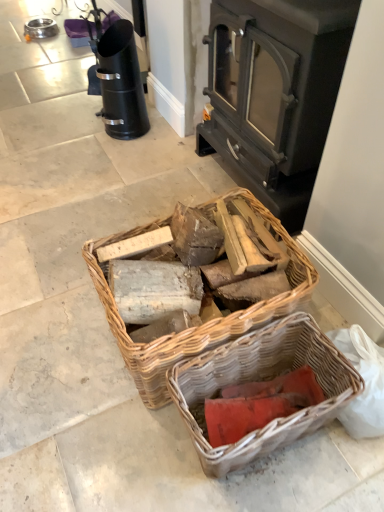
At what (x,y) coordinates should I click in order to perform the action: click on woven wood basket at center, the first picnic basket viewed from the top. Please return your answer as a coordinate pair (x, y). Image resolution: width=384 pixels, height=512 pixels. Looking at the image, I should click on (205, 324).

The image size is (384, 512). What do you see at coordinates (275, 93) in the screenshot? I see `dark gray metal wood burning stove at center` at bounding box center [275, 93].

In order to click on red cardboard at lower center in this screenshot , I will do `click(258, 404)`.

The height and width of the screenshot is (512, 384). In order to click on woven wood basket at center, the first picnic basket viewed from the top in this screenshot , I will do `click(205, 324)`.

From the image's perspective, between woven wood basket at center, which ranks as the 2th picnic basket in bottom-to-top order, and rustic wicker basket at lower center, which is the 1th picnic basket in bottom-to-top order, who is located below?

rustic wicker basket at lower center, which is the 1th picnic basket in bottom-to-top order.

Is woven wood basket at center, which ranks as the 2th picnic basket in bottom-to-top order, closer to camera compared to rustic wicker basket at lower center, which appears as the second picnic basket when viewed from the top?

That is False.

Is woven wood basket at center, the first picnic basket viewed from the top, to the left of rustic wicker basket at lower center, which appears as the second picnic basket when viewed from the top, from the viewer's perspective?

Yes, woven wood basket at center, the first picnic basket viewed from the top, is to the left of rustic wicker basket at lower center, which appears as the second picnic basket when viewed from the top.

Can you confirm if woven wood basket at center, the first picnic basket viewed from the top, is bigger than dark gray metal wood burning stove at center?

No, woven wood basket at center, the first picnic basket viewed from the top, is not bigger than dark gray metal wood burning stove at center.

From a real-world perspective, does woven wood basket at center, the first picnic basket viewed from the top, stand above dark gray metal wood burning stove at center?

Incorrect, from a real-world perspective, woven wood basket at center, the first picnic basket viewed from the top, is lower than dark gray metal wood burning stove at center.

Can dark gray metal wood burning stove at center be found inside woven wood basket at center, which ranks as the 2th picnic basket in bottom-to-top order?

No, dark gray metal wood burning stove at center is not surrounded by woven wood basket at center, which ranks as the 2th picnic basket in bottom-to-top order.

From the image's perspective, is woven wood basket at center, the first picnic basket viewed from the top, located above or below dark gray metal wood burning stove at center?

Clearly, from the image's perspective, woven wood basket at center, the first picnic basket viewed from the top, is below dark gray metal wood burning stove at center.

From a real-world perspective, which picnic basket is the 2nd one underneath the dark gray metal wood burning stove at center? Please provide its 2D coordinates.

[(260, 380)]

Considering the relative positions of rustic wicker basket at lower center, which appears as the second picnic basket when viewed from the top, and dark gray metal wood burning stove at center in the image provided, is rustic wicker basket at lower center, which appears as the second picnic basket when viewed from the top, in front of dark gray metal wood burning stove at center?

That is True.

In the scene shown: Is rustic wicker basket at lower center, which appears as the second picnic basket when viewed from the top, spatially inside dark gray metal wood burning stove at center, or outside of it?

rustic wicker basket at lower center, which appears as the second picnic basket when viewed from the top, cannot be found inside dark gray metal wood burning stove at center.

Is point (300, 379) less distant than point (305, 266)?

That is False.

Is red cardboard at lower center directly adjacent to woven wood basket at center, the first picnic basket viewed from the top?

No, red cardboard at lower center is not in contact with woven wood basket at center, the first picnic basket viewed from the top.

Looking at this image, is red cardboard at lower center wider than woven wood basket at center, the first picnic basket viewed from the top?

No.

Considering the relative positions of red cardboard at lower center and woven wood basket at center, which ranks as the 2th picnic basket in bottom-to-top order, in the image provided, is red cardboard at lower center in front of woven wood basket at center, which ranks as the 2th picnic basket in bottom-to-top order,?

No, red cardboard at lower center is behind woven wood basket at center, which ranks as the 2th picnic basket in bottom-to-top order.

Are red cardboard at lower center and rustic wicker basket at lower center, which is the 1th picnic basket in bottom-to-top order, far apart?

red cardboard at lower center is actually quite close to rustic wicker basket at lower center, which is the 1th picnic basket in bottom-to-top order.

Looking at this image, is rustic wicker basket at lower center, which is the 1th picnic basket in bottom-to-top order, inside red cardboard at lower center?

No, red cardboard at lower center does not contain rustic wicker basket at lower center, which is the 1th picnic basket in bottom-to-top order.

Considering the points (284, 389) and (215, 391), which point is in front, point (284, 389) or point (215, 391)?

Positioned in front is point (215, 391).

How much distance is there between red cardboard at lower center and rustic wicker basket at lower center, which is the 1th picnic basket in bottom-to-top order?

red cardboard at lower center is 3.44 inches from rustic wicker basket at lower center, which is the 1th picnic basket in bottom-to-top order.

Which object is closer to the camera taking this photo, dark gray metal wood burning stove at center or woven wood basket at center, which ranks as the 2th picnic basket in bottom-to-top order?

woven wood basket at center, which ranks as the 2th picnic basket in bottom-to-top order.

From the image's perspective, is dark gray metal wood burning stove at center located above woven wood basket at center, which ranks as the 2th picnic basket in bottom-to-top order?

Correct, dark gray metal wood burning stove at center appears higher than woven wood basket at center, which ranks as the 2th picnic basket in bottom-to-top order, in the image.

Is dark gray metal wood burning stove at center beside woven wood basket at center, the first picnic basket viewed from the top?

No.

Who is shorter, red cardboard at lower center or dark gray metal wood burning stove at center?

Standing shorter between the two is red cardboard at lower center.

Considering the relative positions of red cardboard at lower center and dark gray metal wood burning stove at center in the image provided, is red cardboard at lower center to the right of dark gray metal wood burning stove at center from the viewer's perspective?

Incorrect, red cardboard at lower center is not on the right side of dark gray metal wood burning stove at center.

At what (x,y) coordinates should I click in order to perform the action: click on wood burning stove above the red cardboard at lower center (from a real-world perspective). Please return your answer as a coordinate pair (x, y). Looking at the image, I should click on (275, 93).

This screenshot has height=512, width=384. Identify the location of picnic basket on the left of rustic wicker basket at lower center, which appears as the second picnic basket when viewed from the top. (205, 324).

Find the location of a particular element. wood burning stove above the woven wood basket at center, the first picnic basket viewed from the top (from the image's perspective) is located at coordinates (275, 93).

Estimate the real-world distances between objects in this image. Which object is closer to dark gray metal wood burning stove at center, rustic wicker basket at lower center, which is the 1th picnic basket in bottom-to-top order, or red cardboard at lower center?

rustic wicker basket at lower center, which is the 1th picnic basket in bottom-to-top order, is positioned closer to the anchor dark gray metal wood burning stove at center.

Considering their positions, is woven wood basket at center, which ranks as the 2th picnic basket in bottom-to-top order, positioned further to red cardboard at lower center than dark gray metal wood burning stove at center?

The object further to red cardboard at lower center is dark gray metal wood burning stove at center.

From the image, which object appears to be nearer to dark gray metal wood burning stove at center, red cardboard at lower center or woven wood basket at center, which ranks as the 2th picnic basket in bottom-to-top order?

Answer: woven wood basket at center, which ranks as the 2th picnic basket in bottom-to-top order, is positioned closer to the anchor dark gray metal wood burning stove at center.

Looking at the image, which one is located closer to rustic wicker basket at lower center, which is the 1th picnic basket in bottom-to-top order, dark gray metal wood burning stove at center or woven wood basket at center, the first picnic basket viewed from the top?

woven wood basket at center, the first picnic basket viewed from the top, lies closer to rustic wicker basket at lower center, which is the 1th picnic basket in bottom-to-top order, than the other object.

Considering their positions, is rustic wicker basket at lower center, which is the 1th picnic basket in bottom-to-top order, positioned closer to woven wood basket at center, the first picnic basket viewed from the top, than red cardboard at lower center?

rustic wicker basket at lower center, which is the 1th picnic basket in bottom-to-top order, is positioned closer to the anchor woven wood basket at center, the first picnic basket viewed from the top.

Considering their positions, is red cardboard at lower center positioned closer to woven wood basket at center, the first picnic basket viewed from the top, than dark gray metal wood burning stove at center?

Based on the image, red cardboard at lower center appears to be nearer to woven wood basket at center, the first picnic basket viewed from the top.

Looking at the image, which one is located further to dark gray metal wood burning stove at center, woven wood basket at center, the first picnic basket viewed from the top, or red cardboard at lower center?

Based on the image, red cardboard at lower center appears to be further to dark gray metal wood burning stove at center.

Estimate the real-world distances between objects in this image. Which object is closer to dark gray metal wood burning stove at center, woven wood basket at center, the first picnic basket viewed from the top, or rustic wicker basket at lower center, which is the 1th picnic basket in bottom-to-top order?

The object closer to dark gray metal wood burning stove at center is woven wood basket at center, the first picnic basket viewed from the top.

Identify the location of picnic basket between woven wood basket at center, the first picnic basket viewed from the top, and red cardboard at lower center from top to bottom. (260, 380).

Identify the location of picnic basket between dark gray metal wood burning stove at center and rustic wicker basket at lower center, which appears as the second picnic basket when viewed from the top, in the vertical direction. The image size is (384, 512). (205, 324).